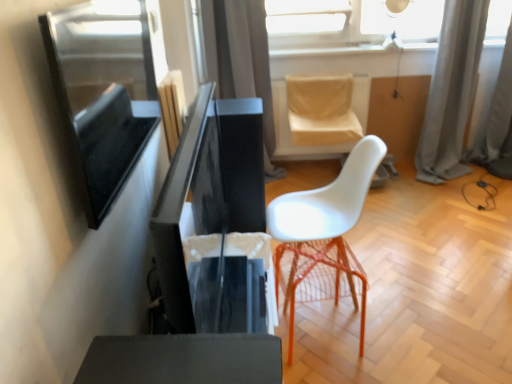
Find the location of a particular element. This screenshot has width=512, height=384. vacant area that is in front of gray fabric curtain at upper right, which is the second curtain in left-to-right order is located at coordinates (432, 206).